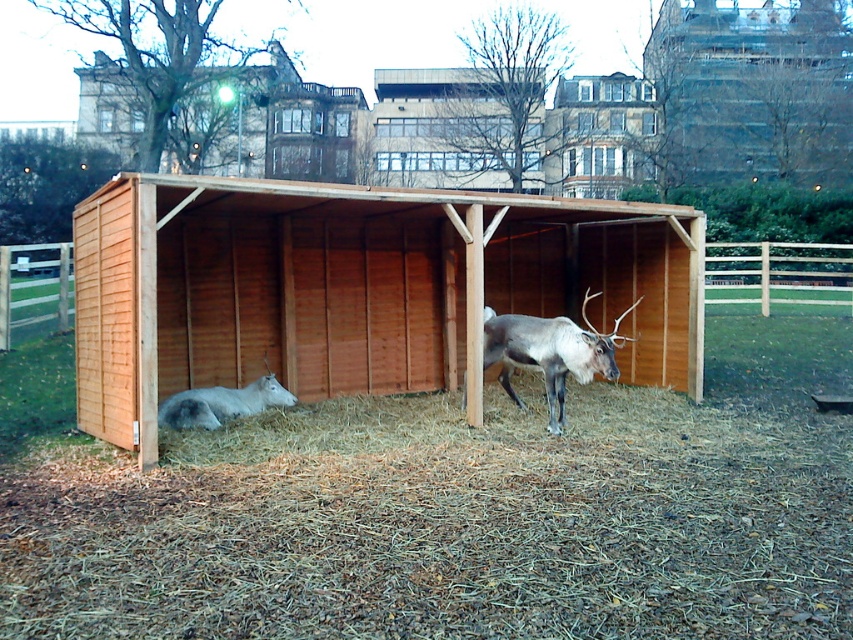
Is wooden shed at upper center positioned behind brown wooden hut at upper center?

No, wooden shed at upper center is in front of brown wooden hut at upper center.

Does point (692, 29) come closer to viewer compared to point (555, 163)?

No, (692, 29) is behind (555, 163).

Find the location of `wooden shed at upper center`. wooden shed at upper center is located at coordinates (752, 92).

Where is `brown wooden barn at upper center`? The image size is (853, 640). brown wooden barn at upper center is located at coordinates (265, 124).

Measure the distance between brown wooden barn at upper center and camera.

They are 29.35 meters apart.

Find the location of `brown wooden barn at upper center`. brown wooden barn at upper center is located at coordinates (265, 124).

Is wooden shed at upper center above white fur at lower left?

Yes, wooden shed at upper center is above white fur at lower left.

Between point (778, 120) and point (282, 396), which one is positioned behind?

Point (778, 120)

Measure the distance between point (712, 132) and camera.

108.50 feet

Where is `wooden shed at upper center`? This screenshot has height=640, width=853. wooden shed at upper center is located at coordinates (752, 92).